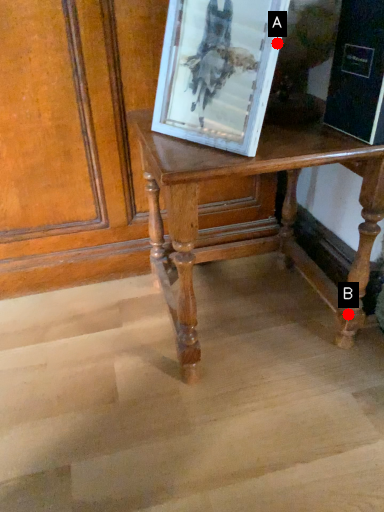
Question: Two points are circled on the image, labeled by A and B beside each circle. Which point is farther from the camera taking this photo?

Choices:
 (A) A is further
 (B) B is further

Answer: (B)